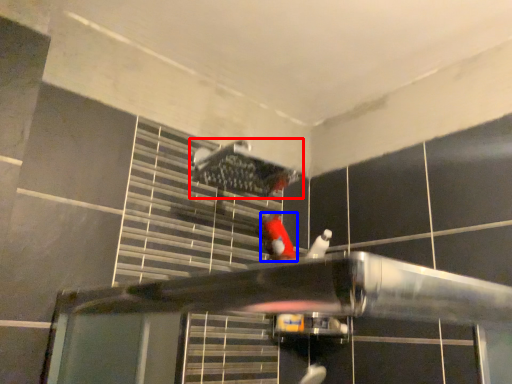
Question: Which point is closer to the camera, shower (highlighted by a red box) or person (highlighted by a blue box)?

Choices:
 (A) shower
 (B) person

Answer: (A)